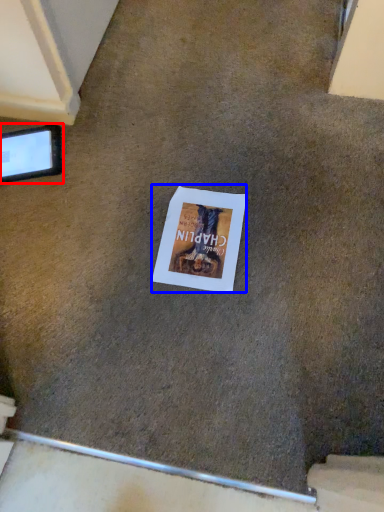
Question: Which point is further to the camera, tablet computer (highlighted by a red box) or flyer (highlighted by a blue box)?

Choices:
 (A) tablet computer
 (B) flyer

Answer: (A)